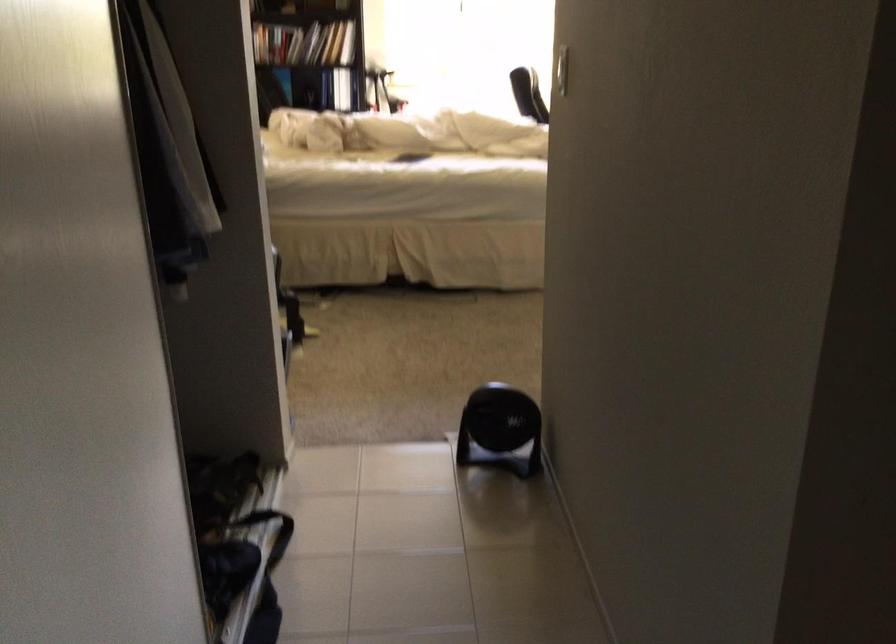
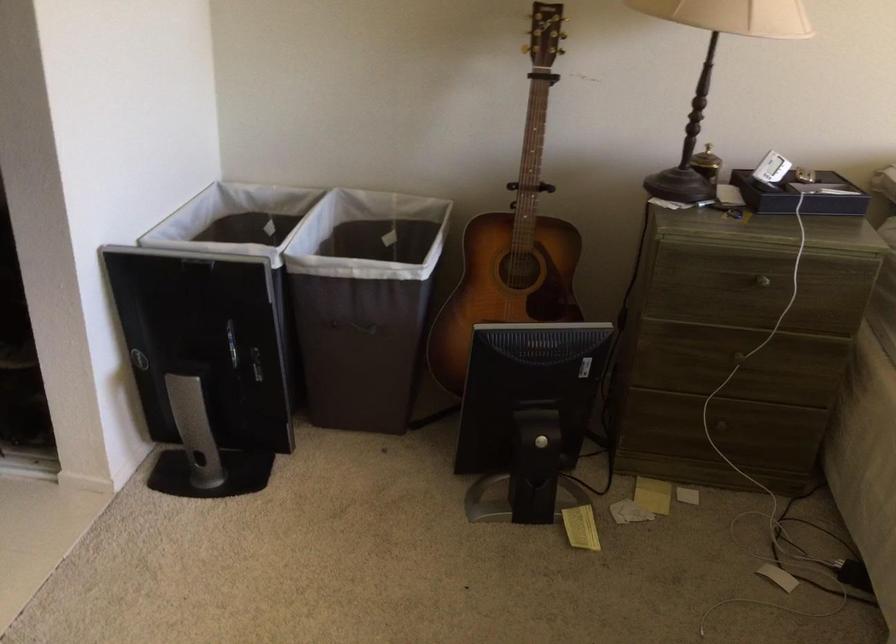
Locate, in the second image, the point that corresponds to the point at 316,330 in the first image.

(581, 527)